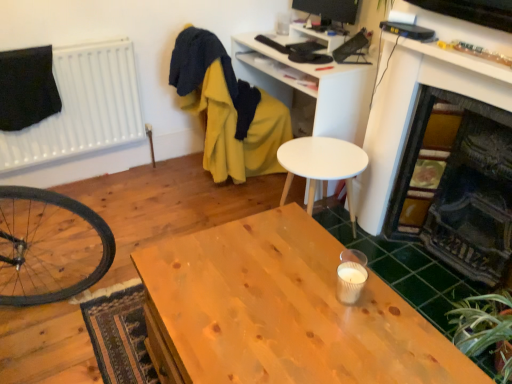
Question: Is black glossy monitor at upper center at the left side of white matte computer desk at upper center?

Choices:
 (A) yes
 (B) no

Answer: (B)

Question: Considering the relative sizes of black glossy monitor at upper center and white matte computer desk at upper center in the image provided, is black glossy monitor at upper center taller than white matte computer desk at upper center?

Choices:
 (A) no
 (B) yes

Answer: (A)

Question: Considering the relative sizes of black glossy monitor at upper center and white matte computer desk at upper center in the image provided, is black glossy monitor at upper center thinner than white matte computer desk at upper center?

Choices:
 (A) yes
 (B) no

Answer: (A)

Question: Is black glossy monitor at upper center with white matte computer desk at upper center?

Choices:
 (A) no
 (B) yes

Answer: (A)

Question: Can white matte computer desk at upper center be found inside black glossy monitor at upper center?

Choices:
 (A) no
 (B) yes

Answer: (A)

Question: From a real-world perspective, is black glossy monitor at upper center located higher than white matte computer desk at upper center?

Choices:
 (A) yes
 (B) no

Answer: (A)

Question: From a real-world perspective, is yellow fabric swivel chair at upper center positioned over black glossy monitor at upper center based on gravity?

Choices:
 (A) no
 (B) yes

Answer: (A)

Question: Can you confirm if yellow fabric swivel chair at upper center is smaller than black glossy monitor at upper center?

Choices:
 (A) yes
 (B) no

Answer: (B)

Question: From a real-world perspective, is yellow fabric swivel chair at upper center below black glossy monitor at upper center?

Choices:
 (A) yes
 (B) no

Answer: (A)

Question: Is yellow fabric swivel chair at upper center far from black glossy monitor at upper center?

Choices:
 (A) no
 (B) yes

Answer: (A)

Question: Is yellow fabric swivel chair at upper center outside of black glossy monitor at upper center?

Choices:
 (A) yes
 (B) no

Answer: (A)

Question: Is yellow fabric swivel chair at upper center looking in the opposite direction of black glossy monitor at upper center?

Choices:
 (A) no
 (B) yes

Answer: (A)

Question: Can you confirm if green leafy plant at lower right is smaller than white matte computer desk at upper center?

Choices:
 (A) no
 (B) yes

Answer: (B)